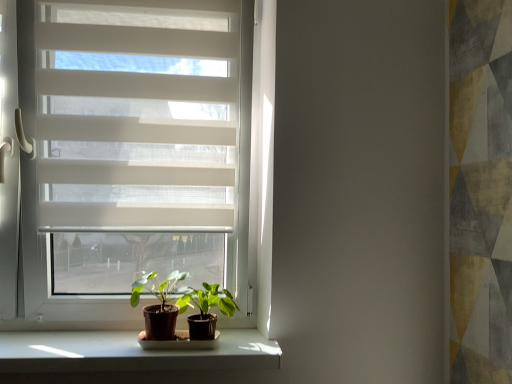
In order to click on free location to the right of brown matte pot at lower center in this screenshot , I will do `click(239, 342)`.